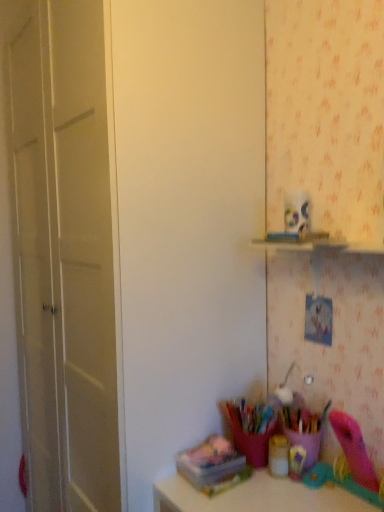
Question: From the image's perspective, does matte gold container at lower center, marked as the second stationery in a left-to-right arrangement, appear lower than matte white door at left?

Choices:
 (A) yes
 (B) no

Answer: (A)

Question: Does matte gold container at lower center, the 2th stationery in the right-to-left sequence, contain matte white door at left?

Choices:
 (A) yes
 (B) no

Answer: (B)

Question: Are matte gold container at lower center, the 2th stationery in the right-to-left sequence, and matte white door at left located far from each other?

Choices:
 (A) yes
 (B) no

Answer: (B)

Question: Does matte gold container at lower center, marked as the second stationery in a left-to-right arrangement, have a greater height compared to matte white door at left?

Choices:
 (A) yes
 (B) no

Answer: (B)

Question: Can you confirm if matte gold container at lower center, marked as the second stationery in a left-to-right arrangement, is thinner than matte white door at left?

Choices:
 (A) yes
 (B) no

Answer: (A)

Question: From the image's perspective, relative to matte white door at left, is translucent plastic container at lower right, the third stationery from the left, above or below?

Choices:
 (A) below
 (B) above

Answer: (A)

Question: Is translucent plastic container at lower right, the third stationery from the left, to the left or to the right of matte white door at left in the image?

Choices:
 (A) right
 (B) left

Answer: (A)

Question: Is translucent plastic container at lower right, which is the first stationery in right-to-left order, bigger or smaller than matte white door at left?

Choices:
 (A) small
 (B) big

Answer: (A)

Question: In terms of width, does translucent plastic container at lower right, the third stationery from the left, look wider or thinner when compared to matte white door at left?

Choices:
 (A) wide
 (B) thin

Answer: (B)

Question: Considering the positions of translucent plastic container at lower right, which is the first stationery in right-to-left order, and translucent plastic container at lower center, marked as the first stationery in a left-to-right arrangement, in the image, is translucent plastic container at lower right, which is the first stationery in right-to-left order, bigger or smaller than translucent plastic container at lower center, marked as the first stationery in a left-to-right arrangement,?

Choices:
 (A) big
 (B) small

Answer: (A)

Question: Do you think translucent plastic container at lower right, which is the first stationery in right-to-left order, is within translucent plastic container at lower center, marked as the first stationery in a left-to-right arrangement, or outside of it?

Choices:
 (A) inside
 (B) outside

Answer: (B)

Question: From a real-world perspective, is translucent plastic container at lower right, which is the first stationery in right-to-left order, above or below translucent plastic container at lower center, the 3th stationery from the right?

Choices:
 (A) below
 (B) above

Answer: (B)

Question: In the image, is translucent plastic container at lower right, which is the first stationery in right-to-left order, positioned in front of or behind translucent plastic container at lower center, marked as the first stationery in a left-to-right arrangement?

Choices:
 (A) behind
 (B) front

Answer: (A)

Question: Is matte gold container at lower center, marked as the second stationery in a left-to-right arrangement, inside the boundaries of translucent plastic container at lower center, marked as the first stationery in a left-to-right arrangement, or outside?

Choices:
 (A) outside
 (B) inside

Answer: (A)

Question: In the image, is matte gold container at lower center, the 2th stationery in the right-to-left sequence, on the left side or the right side of translucent plastic container at lower center, the 3th stationery from the right?

Choices:
 (A) right
 (B) left

Answer: (A)